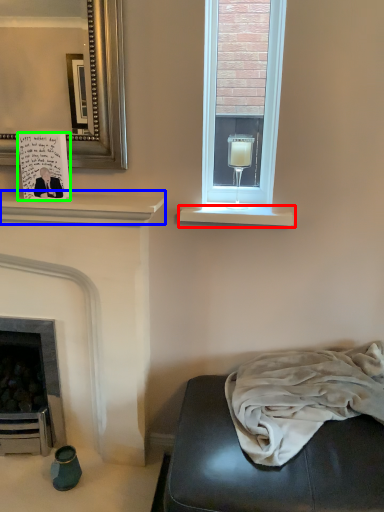
Question: Considering the real-world distances, which object is closest to window sill (highlighted by a red box)? mantle (highlighted by a blue box) or postcard (highlighted by a green box).

Choices:
 (A) mantle
 (B) postcard

Answer: (A)